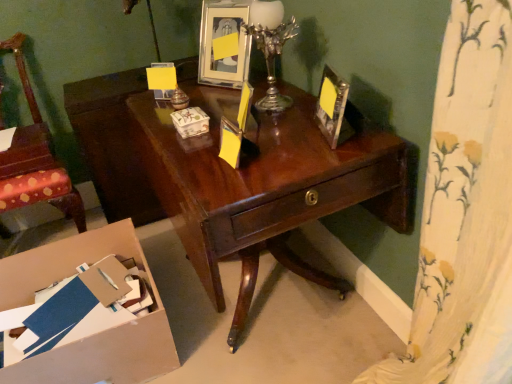
Where is `free spot to the left of metallic silver picture frame at upper center, arranged as the second picture frame when viewed from the front`? This screenshot has height=384, width=512. free spot to the left of metallic silver picture frame at upper center, arranged as the second picture frame when viewed from the front is located at coordinates (193, 93).